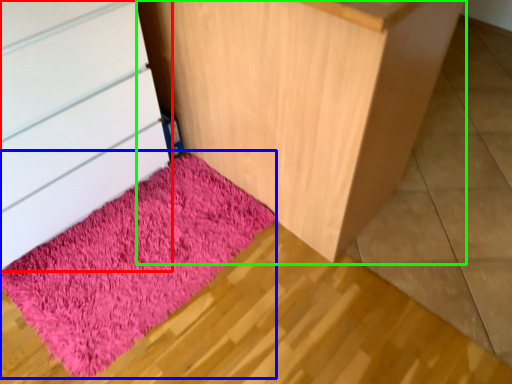
Question: Which object is the closest to the chest of drawers (highlighted by a red box)? Choose among these: mat (highlighted by a blue box) or furniture (highlighted by a green box).

Choices:
 (A) mat
 (B) furniture

Answer: (A)